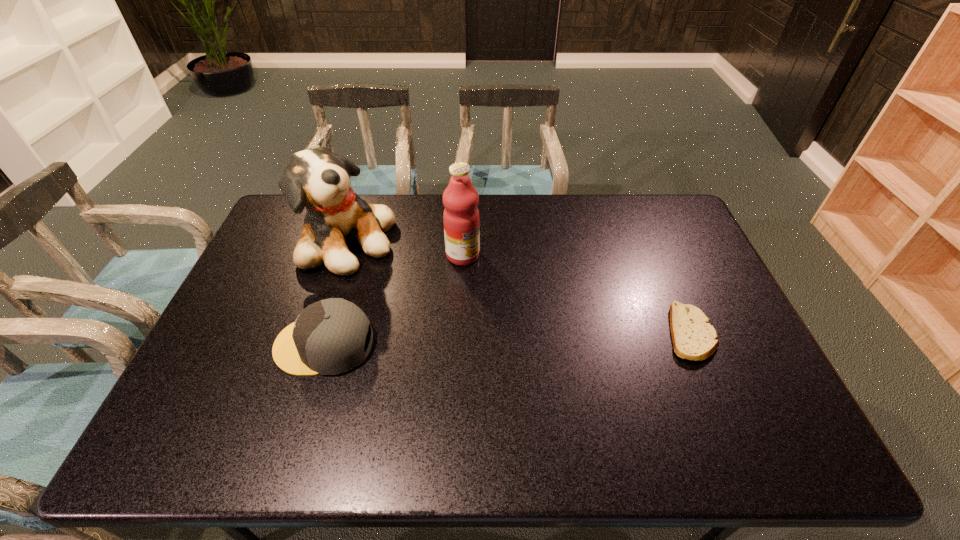
The width and height of the screenshot is (960, 540). I want to click on free space on the desktop that is between the cap and the pita bread and is positioned on the label of the second object from right to left, so click(553, 337).

Locate an element on the screen. The height and width of the screenshot is (540, 960). vacant spot on the desktop that is between the third tallest object and the shortest object and is positioned at the face of the puppy is located at coordinates (531, 338).